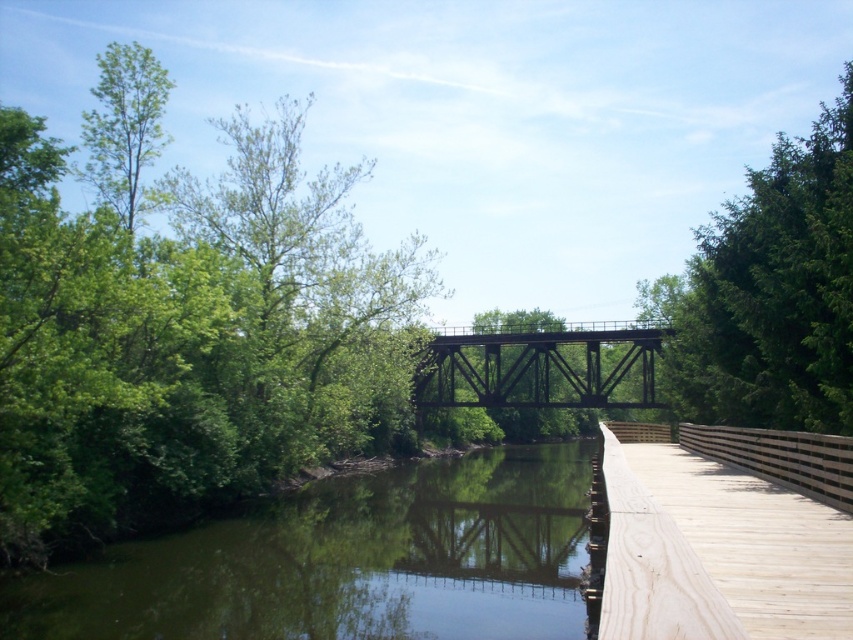
Between green leafy tree at upper right and green matte bridge at center, which one appears on the right side from the viewer's perspective?

From the viewer's perspective, green leafy tree at upper right appears more on the right side.

Can you confirm if green leafy tree at upper right is positioned to the right of green matte bridge at center?

Correct, you'll find green leafy tree at upper right to the right of green matte bridge at center.

What do you see at coordinates (770, 292) in the screenshot? This screenshot has height=640, width=853. I see `green leafy tree at upper right` at bounding box center [770, 292].

Where is `green leafy tree at upper right`? The width and height of the screenshot is (853, 640). green leafy tree at upper right is located at coordinates (770, 292).

Does green leafy tree at left have a greater width compared to green matte bridge at center?

Indeed, green leafy tree at left has a greater width compared to green matte bridge at center.

How much distance is there between green leafy tree at left and green matte bridge at center?

green leafy tree at left is 19.62 meters away from green matte bridge at center.

The image size is (853, 640). Describe the element at coordinates (184, 323) in the screenshot. I see `green leafy tree at left` at that location.

Find the location of a particular element. Image resolution: width=853 pixels, height=640 pixels. green leafy tree at left is located at coordinates (184, 323).

Does point (556, 634) come behind point (448, 374)?

No, it is not.

Is green reflective water at lower center to the left of green matte bridge at center from the viewer's perspective?

Indeed, green reflective water at lower center is positioned on the left side of green matte bridge at center.

Where is `green reflective water at lower center`? This screenshot has width=853, height=640. green reflective water at lower center is located at coordinates (346, 563).